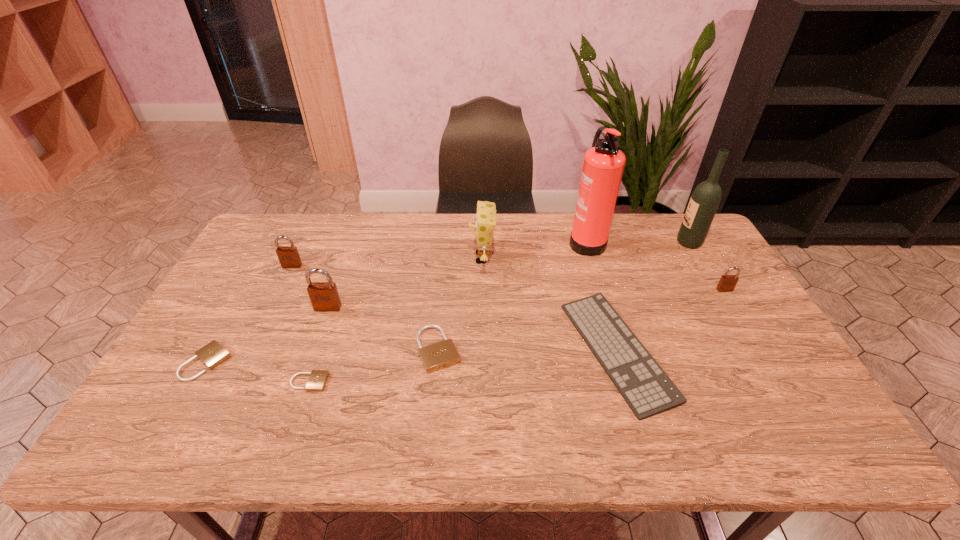
Find the location of a particular element. fire extinguisher is located at coordinates (603, 166).

Locate an element on the screen. This screenshot has width=960, height=540. red fire extinguisher is located at coordinates (603, 166).

The image size is (960, 540). In order to click on green wine bottle in this screenshot , I will do `click(704, 202)`.

The image size is (960, 540). I want to click on the ninth shortest object, so click(x=704, y=202).

You are a GUI agent. You are given a task and a screenshot of the screen. Output one action in this format:
    pyautogui.click(x=<x>, y=<y>)
    Task: Click on the third tallest object
    Image resolution: width=960 pixels, height=540 pixels.
    Given the screenshot: What is the action you would take?
    pyautogui.click(x=485, y=218)

Locate an element on the screen. The image size is (960, 540). the fifth object from right to left is located at coordinates (485, 218).

Where is `the seventh shortest object`? the seventh shortest object is located at coordinates (324, 296).

Image resolution: width=960 pixels, height=540 pixels. I want to click on the biggest brown padlock, so click(324, 296).

Image resolution: width=960 pixels, height=540 pixels. What are the coordinates of `the fifth shortest padlock` in the screenshot? It's located at (288, 256).

The width and height of the screenshot is (960, 540). I want to click on the leftmost brown padlock, so click(288, 256).